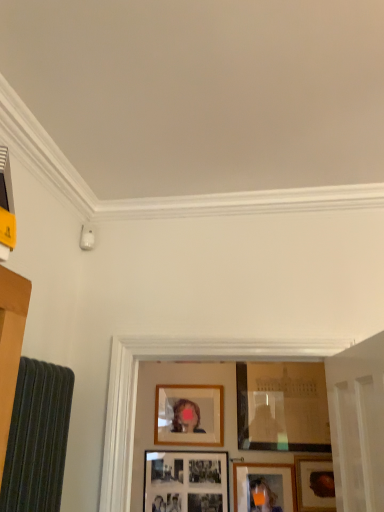
What do you see at coordinates (264, 487) in the screenshot?
I see `matte wooden picture frame at lower center, which is the 3th picture frame in left-to-right order` at bounding box center [264, 487].

Locate an element on the screen. The height and width of the screenshot is (512, 384). matte glass picture frame at center, acting as the 4th picture frame starting from the left is located at coordinates (282, 407).

In order to face wooden frame at lower right, which is the 5th picture frame in left-to-right order, should I rotate leftwards or rightwards?

It's best to rotate right around 16.369 degrees.

Describe the element at coordinates (315, 483) in the screenshot. I see `wooden frame at lower right, acting as the first picture frame starting from the right` at that location.

The image size is (384, 512). Describe the element at coordinates (189, 415) in the screenshot. I see `wooden picture frame at center, the fourth picture frame positioned from the right` at that location.

Find the location of a particular element. The width and height of the screenshot is (384, 512). matte wooden picture frame at lower center, which is the 3th picture frame in left-to-right order is located at coordinates (264, 487).

Is matte black picture frame at lower center, which is the 1th picture frame in left-to-right order, taller or shorter than matte glass picture frame at center, the second picture frame viewed from the right?

Considering their sizes, matte black picture frame at lower center, which is the 1th picture frame in left-to-right order, has less height than matte glass picture frame at center, the second picture frame viewed from the right.

Which of these two, matte black picture frame at lower center, which is the 1th picture frame in left-to-right order, or matte glass picture frame at center, acting as the 4th picture frame starting from the left, is smaller?

matte black picture frame at lower center, which is the 1th picture frame in left-to-right order.

From the image's perspective, is matte black picture frame at lower center, which is the 1th picture frame in left-to-right order, located above or below matte glass picture frame at center, acting as the 4th picture frame starting from the left?

From the image's perspective, matte black picture frame at lower center, which is the 1th picture frame in left-to-right order, appears below matte glass picture frame at center, acting as the 4th picture frame starting from the left.

Could you tell me if matte black picture frame at lower center, the fifth picture frame from the right, is turned towards matte glass picture frame at center, the second picture frame viewed from the right?

No, matte black picture frame at lower center, the fifth picture frame from the right, does not turn towards matte glass picture frame at center, the second picture frame viewed from the right.

Find the location of `the 2nd picture frame to the left when counting from the wooden frame at lower right, which is the 5th picture frame in left-to-right order`. the 2nd picture frame to the left when counting from the wooden frame at lower right, which is the 5th picture frame in left-to-right order is located at coordinates (264, 487).

How different are the orientations of matte wooden picture frame at lower center, the third picture frame when ordered from right to left, and wooden frame at lower right, acting as the first picture frame starting from the right, in degrees?

The facing directions of matte wooden picture frame at lower center, the third picture frame when ordered from right to left, and wooden frame at lower right, acting as the first picture frame starting from the right, are 0.00383 degrees apart.

From a real-world perspective, between matte wooden picture frame at lower center, the third picture frame when ordered from right to left, and wooden frame at lower right, acting as the first picture frame starting from the right, who is vertically higher?

From a 3D spatial view, wooden frame at lower right, acting as the first picture frame starting from the right, is above.

Does matte wooden picture frame at lower center, the third picture frame when ordered from right to left, have a greater height compared to wooden frame at lower right, acting as the first picture frame starting from the right?

No, matte wooden picture frame at lower center, the third picture frame when ordered from right to left, is not taller than wooden frame at lower right, acting as the first picture frame starting from the right.

Based on the photo, how many degrees apart are the facing directions of matte black picture frame at lower center, which is the 1th picture frame in left-to-right order, and matte wooden picture frame at lower center, which is the 3th picture frame in left-to-right order?

0.0111 degrees separate the facing orientations of matte black picture frame at lower center, which is the 1th picture frame in left-to-right order, and matte wooden picture frame at lower center, which is the 3th picture frame in left-to-right order.

Is matte black picture frame at lower center, the fifth picture frame from the right, touching matte wooden picture frame at lower center, the third picture frame when ordered from right to left?

No, matte black picture frame at lower center, the fifth picture frame from the right, is not in contact with matte wooden picture frame at lower center, the third picture frame when ordered from right to left.

Which of these two, matte black picture frame at lower center, the fifth picture frame from the right, or matte wooden picture frame at lower center, the third picture frame when ordered from right to left, is thinner?

With smaller width is matte black picture frame at lower center, the fifth picture frame from the right.

Locate an element on the screen. The height and width of the screenshot is (512, 384). the 2nd picture frame counting from the right of the matte black picture frame at lower center, which is the 1th picture frame in left-to-right order is located at coordinates (264, 487).

From a real-world perspective, is wooden frame at lower right, acting as the first picture frame starting from the right, located higher than matte glass picture frame at center, acting as the 4th picture frame starting from the left?

Incorrect, from a real-world perspective, wooden frame at lower right, acting as the first picture frame starting from the right, is lower than matte glass picture frame at center, acting as the 4th picture frame starting from the left.

Based on the photo, is the surface of wooden frame at lower right, which is the 5th picture frame in left-to-right order, in direct contact with matte glass picture frame at center, acting as the 4th picture frame starting from the left?

There is a gap between wooden frame at lower right, which is the 5th picture frame in left-to-right order, and matte glass picture frame at center, acting as the 4th picture frame starting from the left.

Is wooden frame at lower right, which is the 5th picture frame in left-to-right order, behind matte glass picture frame at center, the second picture frame viewed from the right?

No, the depth of wooden frame at lower right, which is the 5th picture frame in left-to-right order, is less than that of matte glass picture frame at center, the second picture frame viewed from the right.

In the image, is wooden frame at lower right, acting as the first picture frame starting from the right, on the left side or the right side of matte glass picture frame at center, the second picture frame viewed from the right?

wooden frame at lower right, acting as the first picture frame starting from the right, is to the right of matte glass picture frame at center, the second picture frame viewed from the right.

Which of these two, matte black picture frame at lower center, the fifth picture frame from the right, or wooden frame at lower right, acting as the first picture frame starting from the right, stands shorter?

wooden frame at lower right, acting as the first picture frame starting from the right, is shorter.

Consider the image. Does matte black picture frame at lower center, which is the 1th picture frame in left-to-right order, appear on the right side of wooden frame at lower right, which is the 5th picture frame in left-to-right order?

No.

From the image's perspective, is matte black picture frame at lower center, the fifth picture frame from the right, located above or below wooden frame at lower right, acting as the first picture frame starting from the right?

From the image's perspective, matte black picture frame at lower center, the fifth picture frame from the right, appears below wooden frame at lower right, acting as the first picture frame starting from the right.

How much distance is there between matte black picture frame at lower center, the fifth picture frame from the right, and wooden frame at lower right, which is the 5th picture frame in left-to-right order?

matte black picture frame at lower center, the fifth picture frame from the right, is 29.33 inches from wooden frame at lower right, which is the 5th picture frame in left-to-right order.

From a real-world perspective, is wooden picture frame at center, positioned as the second picture frame in left-to-right order, physically below matte wooden picture frame at lower center, the third picture frame when ordered from right to left?

Actually, wooden picture frame at center, positioned as the second picture frame in left-to-right order, is physically above matte wooden picture frame at lower center, the third picture frame when ordered from right to left, in the real world.

Which object is more forward, wooden picture frame at center, positioned as the second picture frame in left-to-right order, or matte wooden picture frame at lower center, which is the 3th picture frame in left-to-right order?

matte wooden picture frame at lower center, which is the 3th picture frame in left-to-right order, is in front.

Do you think wooden picture frame at center, the fourth picture frame positioned from the right, is within matte wooden picture frame at lower center, which is the 3th picture frame in left-to-right order, or outside of it?

wooden picture frame at center, the fourth picture frame positioned from the right, exists outside the volume of matte wooden picture frame at lower center, which is the 3th picture frame in left-to-right order.

Based on their sizes in the image, would you say wooden picture frame at center, the fourth picture frame positioned from the right, is bigger or smaller than matte wooden picture frame at lower center, which is the 3th picture frame in left-to-right order?

Clearly, wooden picture frame at center, the fourth picture frame positioned from the right, is larger in size than matte wooden picture frame at lower center, which is the 3th picture frame in left-to-right order.

Is matte wooden picture frame at lower center, the third picture frame when ordered from right to left, not inside matte black picture frame at lower center, the fifth picture frame from the right?

Yes, matte wooden picture frame at lower center, the third picture frame when ordered from right to left, is located beyond the bounds of matte black picture frame at lower center, the fifth picture frame from the right.

From a real-world perspective, does matte wooden picture frame at lower center, which is the 3th picture frame in left-to-right order, sit lower than matte black picture frame at lower center, the fifth picture frame from the right?

Yes.

Could you tell me if matte wooden picture frame at lower center, which is the 3th picture frame in left-to-right order, is facing matte black picture frame at lower center, the fifth picture frame from the right?

No.

Where is `picture frame that is the 3rd object above the matte black picture frame at lower center, the fifth picture frame from the right (from a real-world perspective)`? picture frame that is the 3rd object above the matte black picture frame at lower center, the fifth picture frame from the right (from a real-world perspective) is located at coordinates (282, 407).

At what (x,y) coordinates should I click in order to perform the action: click on the 1st picture frame positioned below the wooden frame at lower right, which is the 5th picture frame in left-to-right order (from the image's perspective). Please return your answer as a coordinate pair (x, y). This screenshot has height=512, width=384. Looking at the image, I should click on (264, 487).

Looking at the image, which one is located closer to matte glass picture frame at center, the second picture frame viewed from the right, wooden picture frame at center, the fourth picture frame positioned from the right, or matte black picture frame at lower center, the fifth picture frame from the right?

wooden picture frame at center, the fourth picture frame positioned from the right.

When comparing their distances from wooden picture frame at center, the fourth picture frame positioned from the right, does matte black picture frame at lower center, which is the 1th picture frame in left-to-right order, or wooden frame at lower right, which is the 5th picture frame in left-to-right order, seem further?

Among the two, wooden frame at lower right, which is the 5th picture frame in left-to-right order, is located further to wooden picture frame at center, the fourth picture frame positioned from the right.

Considering their positions, is matte wooden picture frame at lower center, which is the 3th picture frame in left-to-right order, positioned further to wooden frame at lower right, which is the 5th picture frame in left-to-right order, than matte black picture frame at lower center, the fifth picture frame from the right?

matte black picture frame at lower center, the fifth picture frame from the right, lies further to wooden frame at lower right, which is the 5th picture frame in left-to-right order, than the other object.

Considering their positions, is matte black picture frame at lower center, which is the 1th picture frame in left-to-right order, positioned further to matte wooden picture frame at lower center, which is the 3th picture frame in left-to-right order, than matte glass picture frame at center, acting as the 4th picture frame starting from the left?

matte glass picture frame at center, acting as the 4th picture frame starting from the left, is further to matte wooden picture frame at lower center, which is the 3th picture frame in left-to-right order.

Based on their spatial positions, is matte black picture frame at lower center, the fifth picture frame from the right, or matte wooden picture frame at lower center, which is the 3th picture frame in left-to-right order, further from wooden frame at lower right, acting as the first picture frame starting from the right?

Among the two, matte black picture frame at lower center, the fifth picture frame from the right, is located further to wooden frame at lower right, acting as the first picture frame starting from the right.

Considering their positions, is matte black picture frame at lower center, which is the 1th picture frame in left-to-right order, positioned closer to wooden picture frame at center, positioned as the second picture frame in left-to-right order, than matte glass picture frame at center, the second picture frame viewed from the right?

matte black picture frame at lower center, which is the 1th picture frame in left-to-right order.

When comparing their distances from wooden frame at lower right, acting as the first picture frame starting from the right, does matte glass picture frame at center, the second picture frame viewed from the right, or wooden picture frame at center, the fourth picture frame positioned from the right, seem closer?

Among the two, matte glass picture frame at center, the second picture frame viewed from the right, is located nearer to wooden frame at lower right, acting as the first picture frame starting from the right.

Considering their positions, is matte glass picture frame at center, the second picture frame viewed from the right, positioned closer to wooden picture frame at center, positioned as the second picture frame in left-to-right order, than wooden frame at lower right, which is the 5th picture frame in left-to-right order?

Among the two, matte glass picture frame at center, the second picture frame viewed from the right, is located nearer to wooden picture frame at center, positioned as the second picture frame in left-to-right order.

Where is `picture frame situated between wooden picture frame at center, positioned as the second picture frame in left-to-right order, and matte glass picture frame at center, the second picture frame viewed from the right, from left to right`? picture frame situated between wooden picture frame at center, positioned as the second picture frame in left-to-right order, and matte glass picture frame at center, the second picture frame viewed from the right, from left to right is located at coordinates (264, 487).

Locate an element on the screen. picture frame between matte black picture frame at lower center, which is the 1th picture frame in left-to-right order, and matte wooden picture frame at lower center, the third picture frame when ordered from right to left, in the horizontal direction is located at coordinates (189, 415).